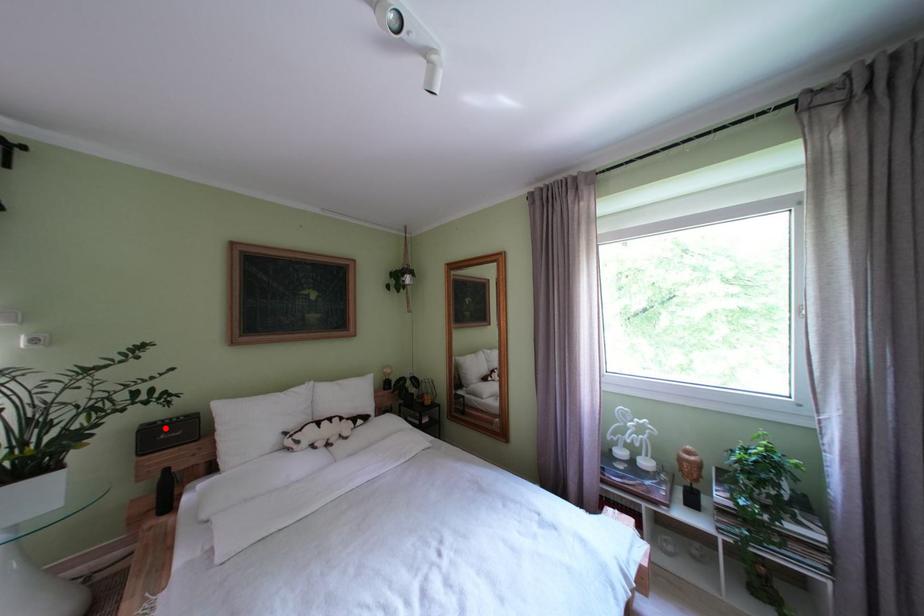
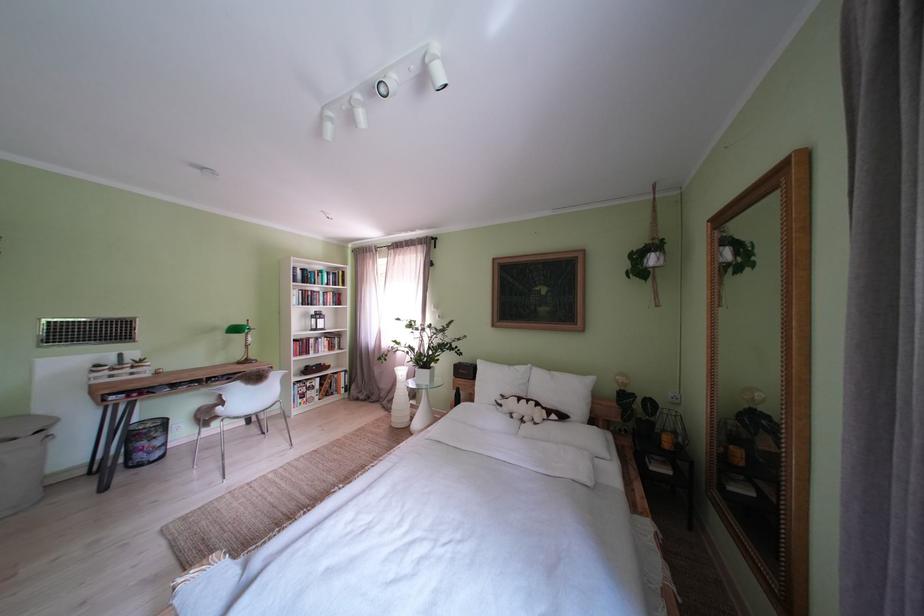
Find the pixel in the second image that matches the highlighted location in the first image.

(472, 369)